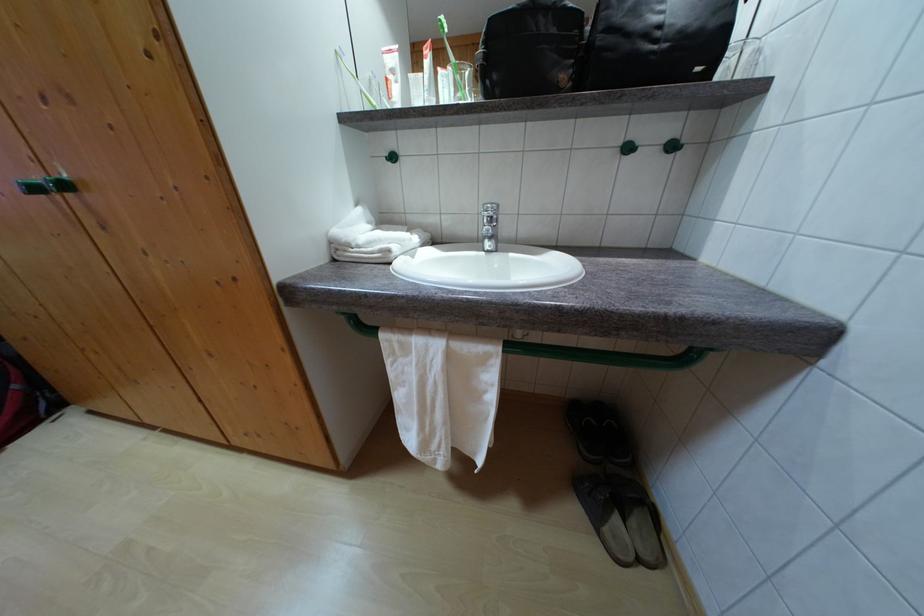
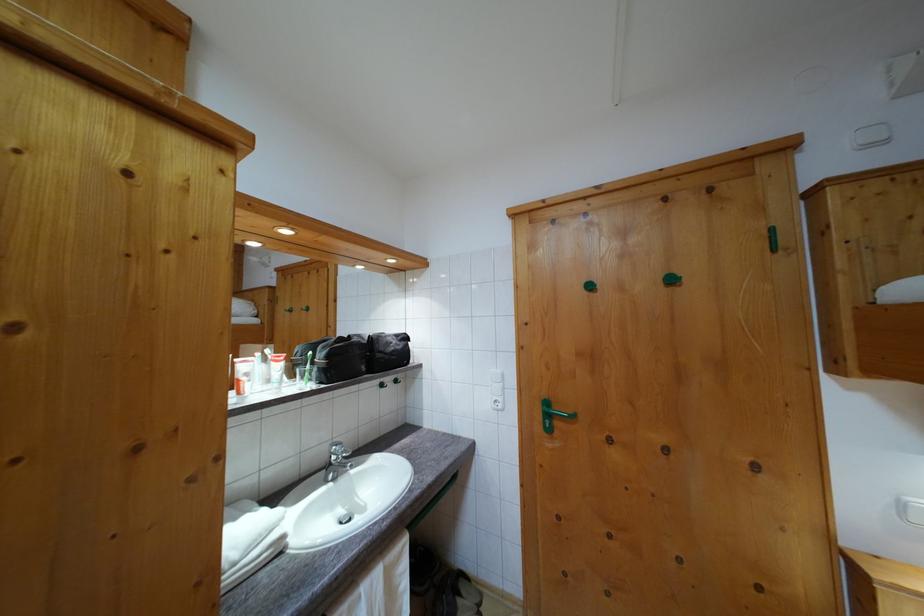
The point at (490, 49) is marked in the first image. Where is the corresponding point in the second image?

(332, 363)